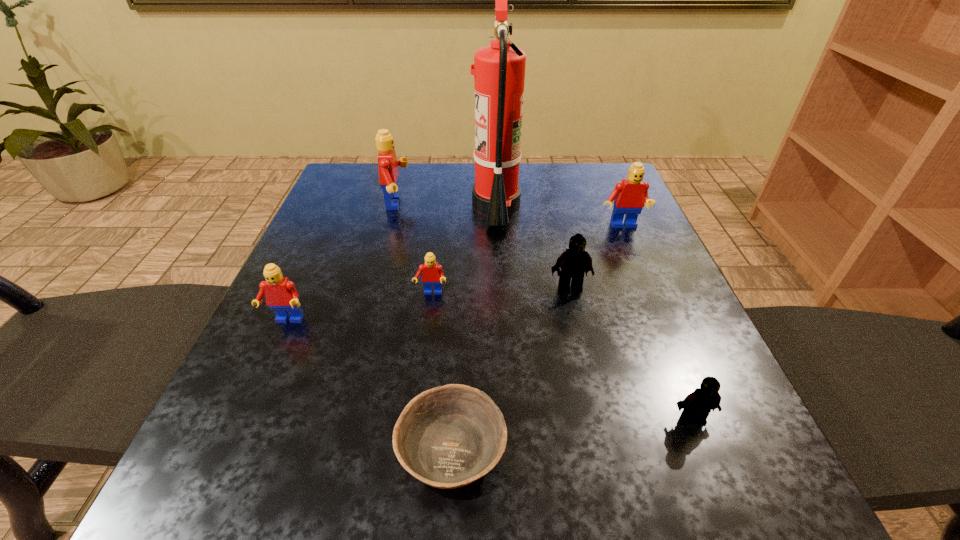
Find the location of `red fire extinguisher`. red fire extinguisher is located at coordinates (499, 69).

You are a GUI agent. You are given a task and a screenshot of the screen. Output one action in this format:
    pyautogui.click(x=<x>, y=<y>)
    Task: Click on the tallest object
    
    Given the screenshot: What is the action you would take?
    pyautogui.click(x=499, y=69)

This screenshot has height=540, width=960. What are the coordinates of `the second tallest object` in the screenshot? It's located at (388, 165).

You are a GUI agent. You are given a task and a screenshot of the screen. Output one action in this format:
    pyautogui.click(x=<x>, y=<y>)
    Task: Click on the seventh object from right to left
    
    Given the screenshot: What is the action you would take?
    pyautogui.click(x=388, y=165)

I want to click on the third tallest object, so (x=629, y=196).

At what (x,y) coordinates should I click in order to perform the action: click on the second tallest Lego. Please return your answer as a coordinate pair (x, y). This screenshot has height=540, width=960. Looking at the image, I should click on (629, 196).

Where is `the third Lego from right to left`? the third Lego from right to left is located at coordinates (574, 262).

This screenshot has height=540, width=960. Identify the location of the farther black Lego. (574, 262).

The height and width of the screenshot is (540, 960). I want to click on the third nearest object, so click(x=281, y=296).

This screenshot has width=960, height=540. I want to click on the leftmost object, so click(281, 296).